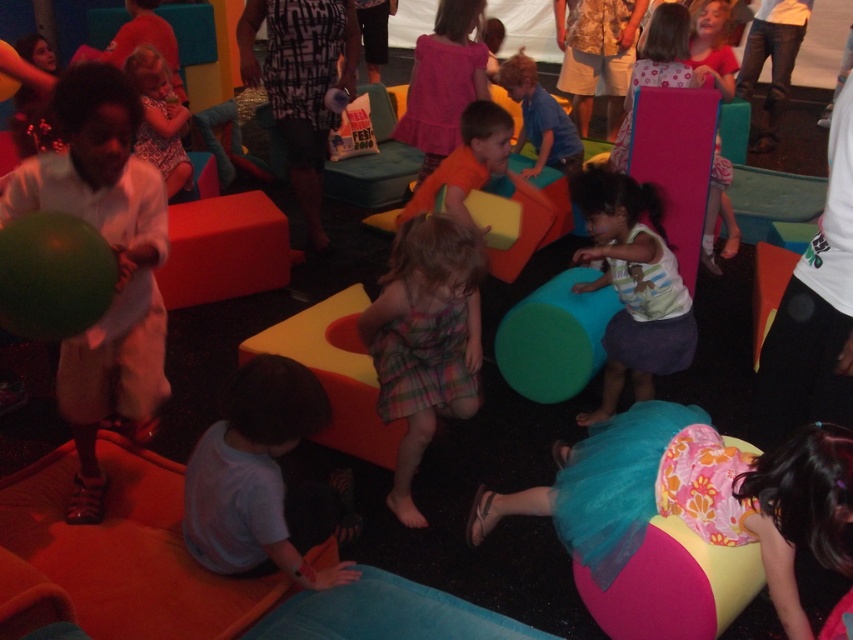
You are navigating a small toy car through the play area and need to move from point A to point B. Point A is at coordinate point(706, 445) and point B is at coordinate point(141, 145). According to the image, which direction should you steer the car to move from point A to point B?

To move from point A at coordinate point(706, 445) to point B at coordinate point(141, 145), you should steer the car backward since point A is in front of point B.

You are a photographer taking a picture of the play area. You want to ensure both the matte white shirt at left and the orange matte shirt at center are visible in the frame. Based on their positions, which shirt is closer to the camera?

The matte white shirt at left is below the orange matte shirt at center, so the orange matte shirt at center is closer to the camera.

You are navigating through the play area and want to reach the exit located at point (498, 136). However, there is an obstacle at point (799, 534). Which point should you avoid to ensure a clear path to the exit?

You should avoid the point (799, 534) because it is closer to you and might block your path to the exit at (498, 136).